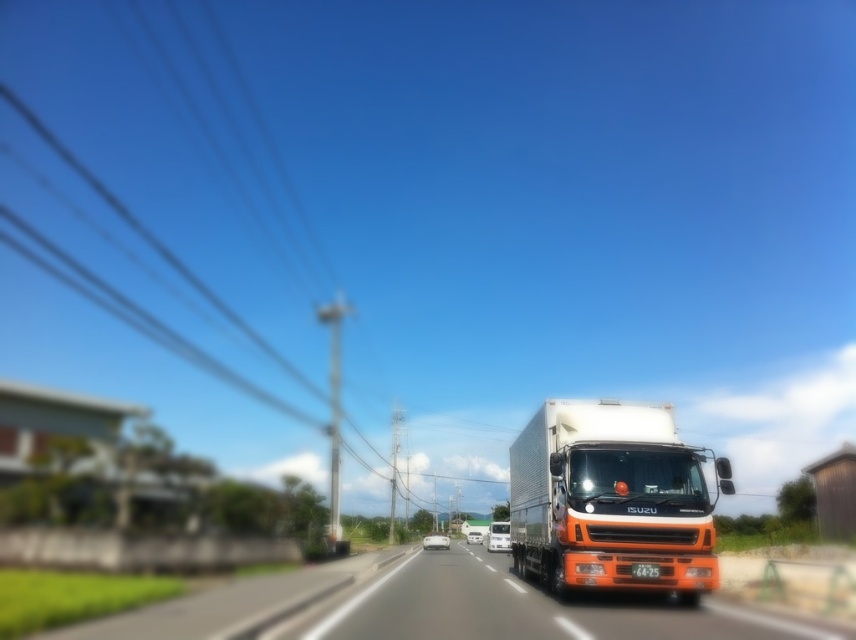
In the scene shown: You are driving a car and see the orange matte truck at center and the orange matte trailer truck at center ahead on the road. Which one is closer to you?

The orange matte truck at center is closer to the viewer than the orange matte trailer truck at center.

You are a delivery driver planning to pass an orange matte trailer truck at center using the orange matte truck at center. Considering the height difference between the two vehicles, would you be able to safely navigate under any low bridges ahead without worrying about the trailer?

The orange matte truck at center is taller than the orange matte trailer truck at center. Since the trailer is shorter, if there are low bridges ahead, the trailer might pass under them safely, but the orange matte truck at center could hit the bridge due to its greater height.

Based on the photo, you are driving a car and see the orange matte truck at center and the orange matte trailer truck at center ahead on the road. Which one is closer to the left edge of the road?

The orange matte truck at center is positioned on the left side of orange matte trailer truck at center, so it is closer to the left edge of the road.